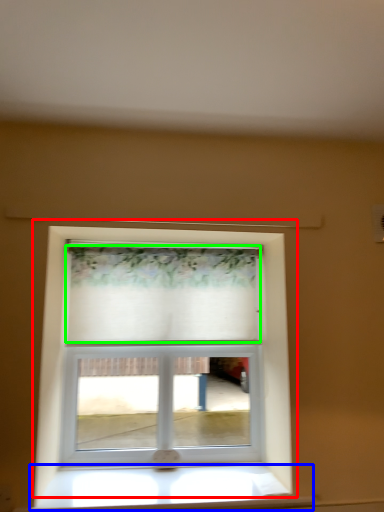
Question: Which is nearer to the window (highlighted by a red box)? window sill (highlighted by a blue box) or curtain (highlighted by a green box).

Choices:
 (A) window sill
 (B) curtain

Answer: (B)